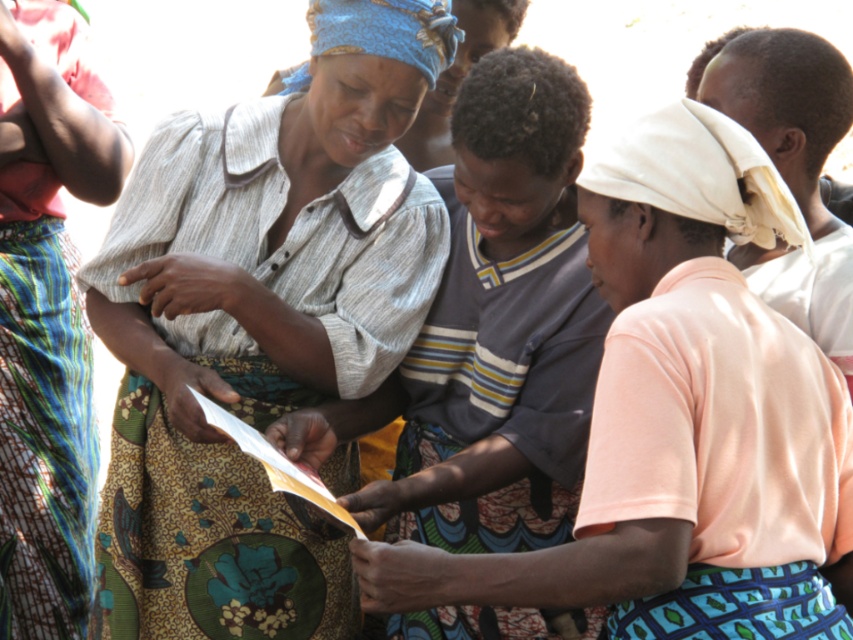
Question: Does matte gray shirt at center have a greater width compared to striped cotton shirt at center?

Choices:
 (A) no
 (B) yes

Answer: (B)

Question: Estimate the real-world distances between objects in this image. Which object is farther from the striped cotton shirt at center?

Choices:
 (A) matte gray shirt at center
 (B) printed fabric skirt at left

Answer: (B)

Question: Does matte gray shirt at center appear on the right side of printed fabric skirt at left?

Choices:
 (A) no
 (B) yes

Answer: (B)

Question: Which of the following is the closest to the observer?

Choices:
 (A) (404, 106)
 (B) (9, 70)
 (C) (570, 237)

Answer: (A)

Question: Which object is the farthest from the printed fabric skirt at left?

Choices:
 (A) matte gray shirt at center
 (B) striped cotton shirt at center

Answer: (B)

Question: From the image, what is the correct spatial relationship of striped cotton shirt at center in relation to printed fabric skirt at left?

Choices:
 (A) right
 (B) left

Answer: (A)